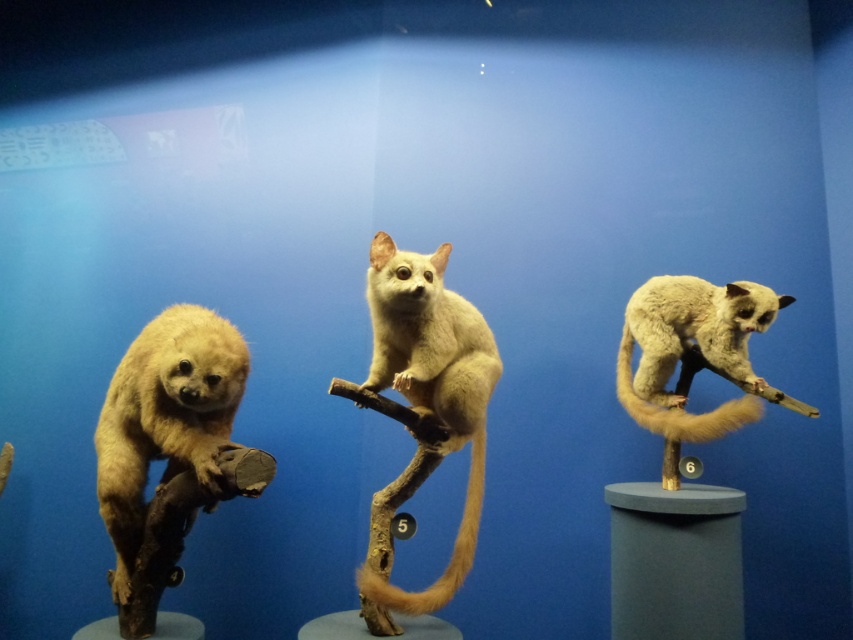
You are a museum curator planning to rearrange the taxidermied animals. You need to place a divider between the light brown fur at left and the fuzzy white tail at right. What is the minimum width the divider needs to be to fit between them?

The divider needs to be at least 3.73 feet wide to fit between the light brown fur at left and the fuzzy white tail at right since they are 3.73 feet apart.

From the picture: You are standing in front of the museum display and notice two points marked on the floor. The first point is at coordinate point(155, 324) and the second is at point(445, 305). Which point is closer to the museum display entrance?

Point(155, 324) is behind point(445, 305), so the closer point to the entrance would be point(445, 305) since it is in front.

You are a museum curator checking the spacing between the fuzzy beige animal at center and the golden fur tail at center. The museum requires a minimum of 5 inches between displayed items for safety. Is the current spacing compliant with the museum guidelines?

The fuzzy beige animal at center and the golden fur tail at center are 4.81 inches apart, which is less than the required 5 inches. Therefore, the spacing does not comply with the museum guidelines.